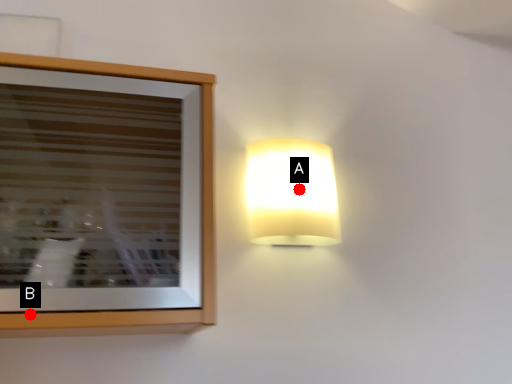
Question: Two points are circled on the image, labeled by A and B beside each circle. Which of the following is the closest to the observer?

Choices:
 (A) A is closer
 (B) B is closer

Answer: (B)